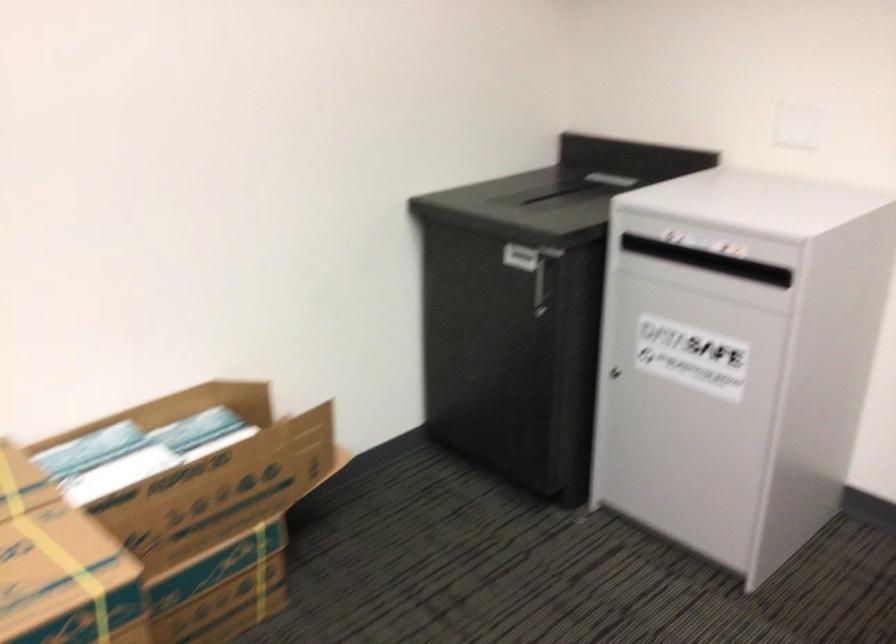
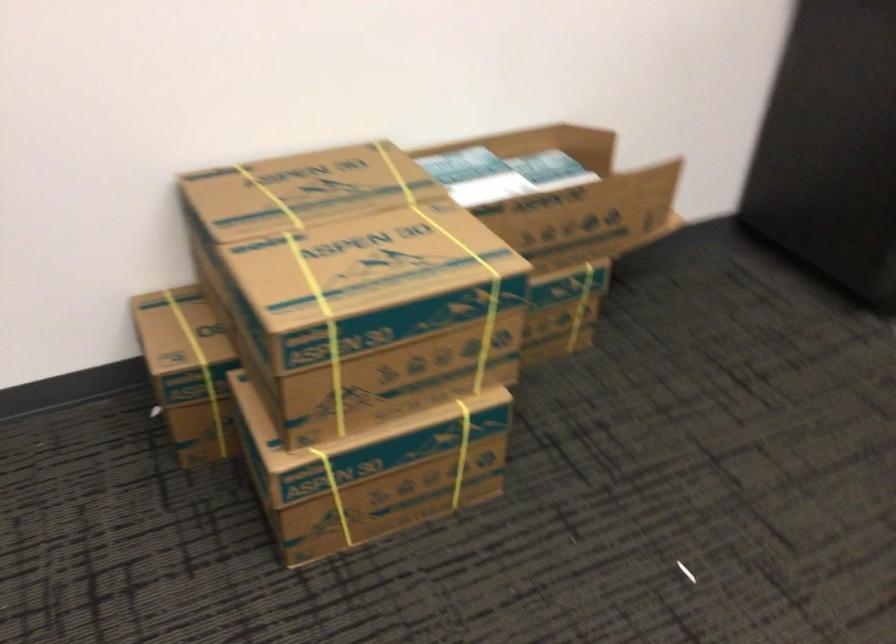
Question: Based on the continuous images, in which direction is the camera rotating? Reply with the corresponding letter.

Choices:
 (A) Left
 (B) Right
 (C) Up
 (D) Down

Answer: (D)